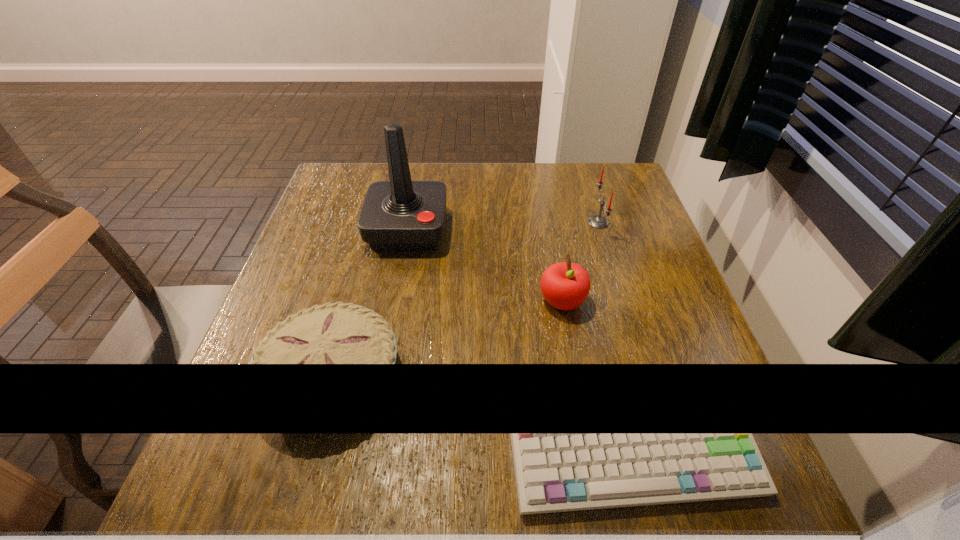
Find the location of a particular element. Image resolution: width=960 pixels, height=540 pixels. vacant region between the apple and the shortest object is located at coordinates (446, 338).

Image resolution: width=960 pixels, height=540 pixels. Identify the location of object that is the third closest to the candle. (339, 333).

This screenshot has height=540, width=960. I want to click on object that is the nearest to the third farthest object, so point(597,221).

Where is `free location that satisfies the following two spatial constraints: 1. on the front-facing side of the rightmost object; 2. on the front side of the third farthest object`? The width and height of the screenshot is (960, 540). free location that satisfies the following two spatial constraints: 1. on the front-facing side of the rightmost object; 2. on the front side of the third farthest object is located at coordinates (622, 302).

The image size is (960, 540). In order to click on vacant space that satisfies the following two spatial constraints: 1. on the back side of the shortest object; 2. on the left side of the apple in this screenshot , I will do `click(351, 302)`.